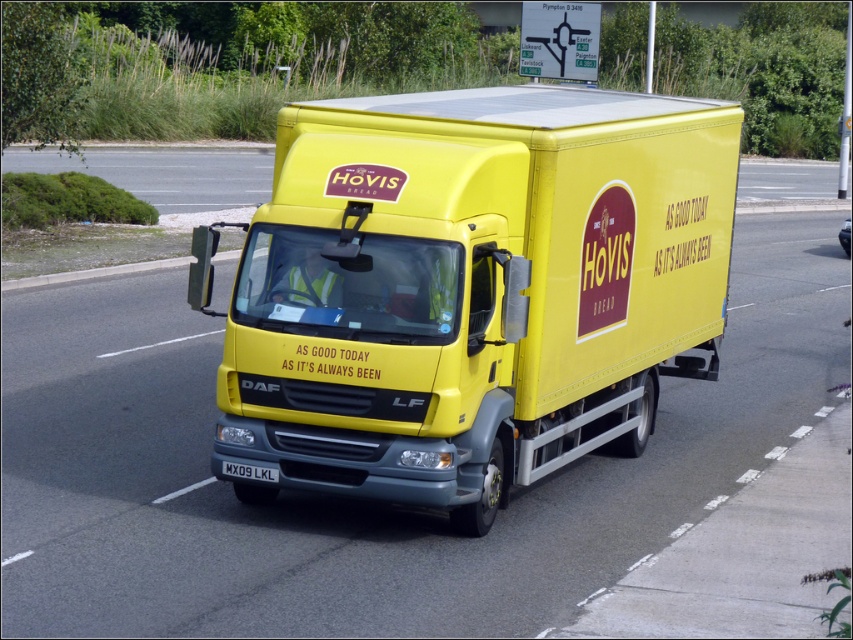
In the scene shown: Is yellow matte truck at center further to camera compared to black plastic license plate at center?

Yes, it is.

Can you confirm if yellow matte truck at center is positioned above black plastic license plate at center?

Correct, yellow matte truck at center is located above black plastic license plate at center.

You are a GUI agent. You are given a task and a screenshot of the screen. Output one action in this format:
    pyautogui.click(x=<x>, y=<y>)
    Task: Click on the yellow matte truck at center
    
    Given the screenshot: What is the action you would take?
    pyautogui.click(x=469, y=289)

The width and height of the screenshot is (853, 640). Find the location of `yellow matte truck at center`. yellow matte truck at center is located at coordinates (x=469, y=289).